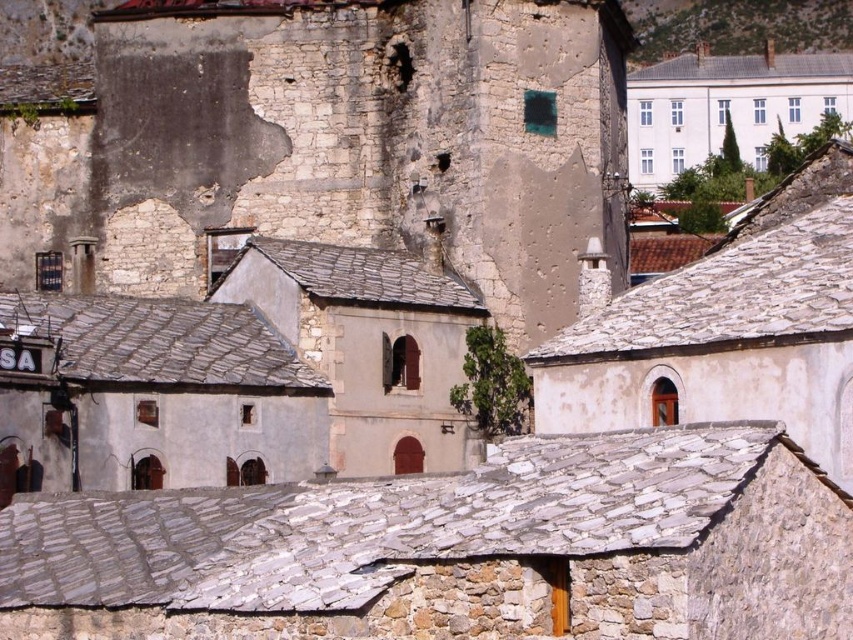
Question: Is white smooth building at upper right smaller than green mossy hillside at upper right?

Choices:
 (A) no
 (B) yes

Answer: (B)

Question: Can you confirm if white smooth building at upper right is positioned to the right of green mossy hillside at upper right?

Choices:
 (A) no
 (B) yes

Answer: (A)

Question: Where is white smooth building at upper right located in relation to green mossy hillside at upper right in the image?

Choices:
 (A) left
 (B) right

Answer: (A)

Question: Which point is closer to the camera?

Choices:
 (A) white smooth building at upper right
 (B) green mossy hillside at upper right

Answer: (A)

Question: Among these objects, which one is nearest to the camera?

Choices:
 (A) green mossy hillside at upper right
 (B) white smooth building at upper right

Answer: (B)

Question: Which point is closer to the camera?

Choices:
 (A) white smooth building at upper right
 (B) green mossy hillside at upper right

Answer: (A)